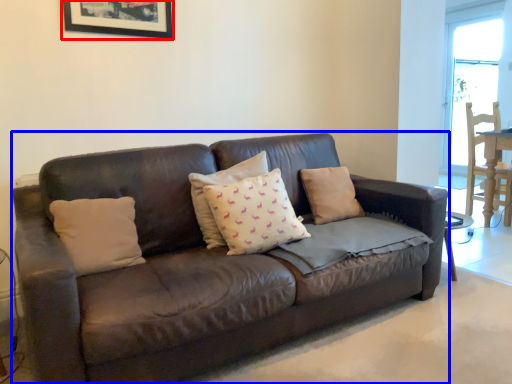
Question: Which object is further to the camera taking this photo, picture frame (highlighted by a red box) or studio couch (highlighted by a blue box)?

Choices:
 (A) picture frame
 (B) studio couch

Answer: (A)